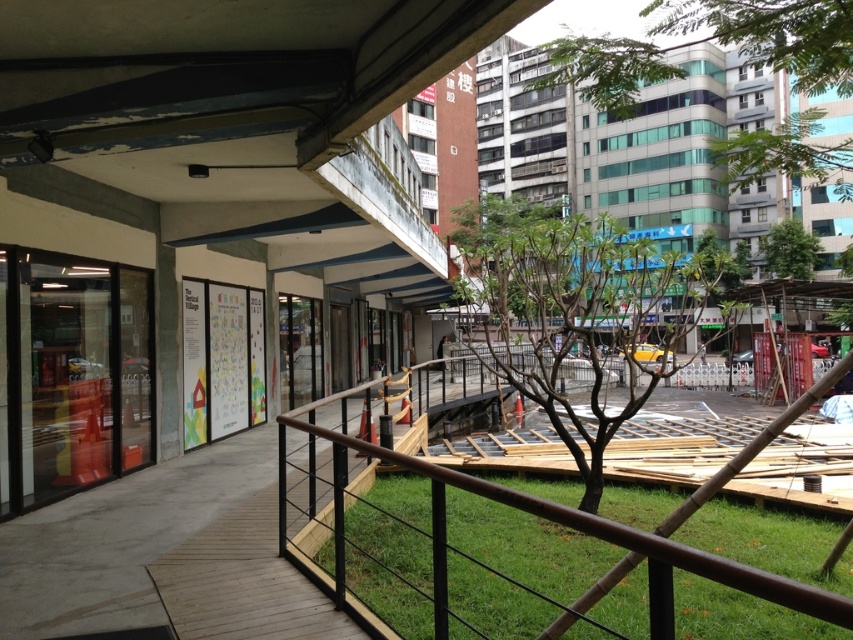
Question: Can you confirm if green leafy tree at center is wider than green leafy tree at upper center?

Choices:
 (A) no
 (B) yes

Answer: (B)

Question: Which of the following is the closest to the observer?

Choices:
 (A) green leafy tree at upper center
 (B) green leafy tree at center
 (C) green leafy tree at upper right
 (D) green grass at lower center

Answer: (A)

Question: Which of the following is the closest to the observer?

Choices:
 (A) green leafy tree at center
 (B) green grass at lower center
 (C) green leafy tree at upper center

Answer: (C)

Question: Is green grass at lower center wider than green leafy tree at upper right?

Choices:
 (A) yes
 (B) no

Answer: (A)

Question: In this image, where is green leafy tree at upper center located relative to green leafy tree at upper right?

Choices:
 (A) left
 (B) right

Answer: (A)

Question: Which of the following is the farthest from the observer?

Choices:
 (A) (480, 282)
 (B) (801, 518)
 (C) (611, 99)

Answer: (B)